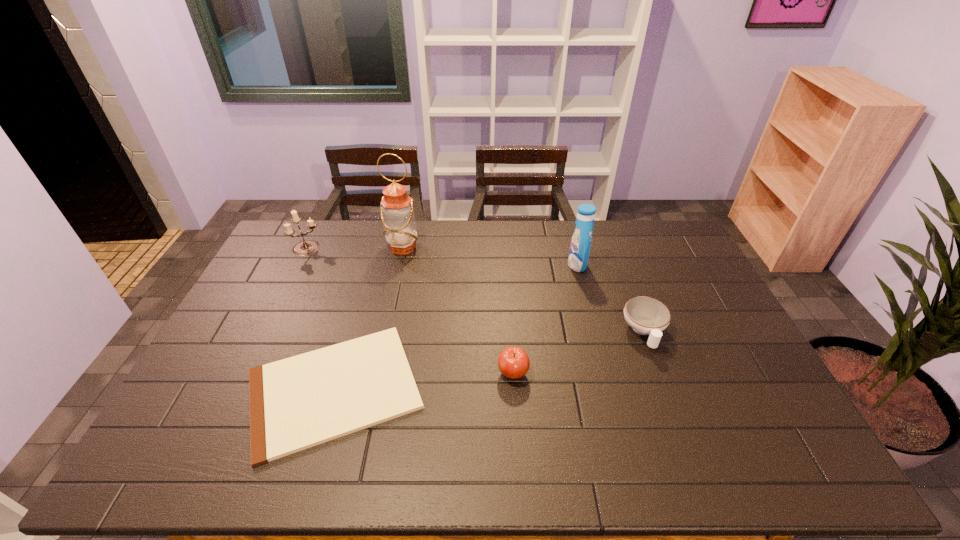
I want to click on vacant space at the far right corner of the desktop, so click(663, 252).

Where is `vacant space in between the shortest object and the third shortest object`? The height and width of the screenshot is (540, 960). vacant space in between the shortest object and the third shortest object is located at coordinates (423, 381).

Identify the location of vacant space that is in between the rightmost object and the fifth object from left to right. (611, 298).

The width and height of the screenshot is (960, 540). I want to click on free space between the fifth tallest object and the fifth object from left to right, so click(611, 298).

Where is `free point between the fifth object from left to right and the candle holder`? This screenshot has width=960, height=540. free point between the fifth object from left to right and the candle holder is located at coordinates (443, 256).

Identify the location of vacant region between the candle holder and the clipboard. (322, 319).

Locate an element on the screen. free spot between the rightmost object and the clipboard is located at coordinates (489, 361).

The width and height of the screenshot is (960, 540). Find the location of `vacant space that is in between the third tallest object and the clipboard`. vacant space that is in between the third tallest object and the clipboard is located at coordinates (322, 319).

At what (x,y) coordinates should I click in order to perform the action: click on free point between the third tallest object and the apple. Please return your answer as a coordinate pair (x, y). Looking at the image, I should click on coord(411,310).

At what (x,y) coordinates should I click in order to perform the action: click on vacant space that is in between the tallest object and the second tallest object. Please return your answer as a coordinate pair (x, y). Looking at the image, I should click on (490, 256).